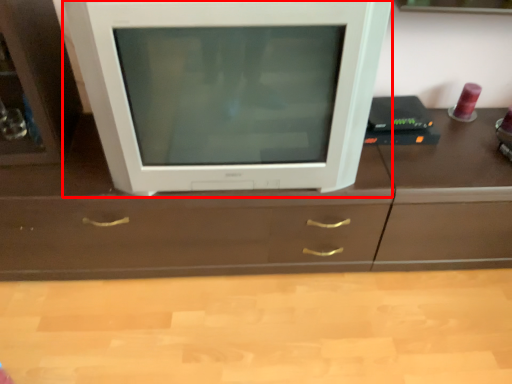
Question: Observing the image, what is the correct spatial positioning of television (annotated by the red box) in reference to counter top?

Choices:
 (A) right
 (B) left

Answer: (B)